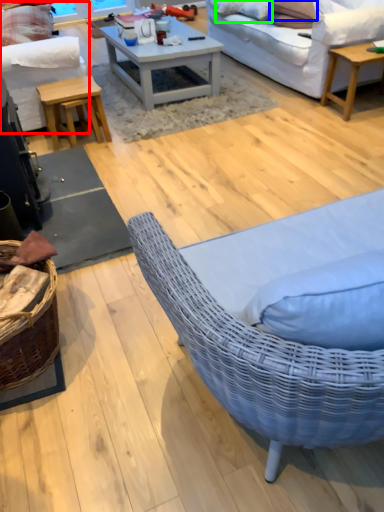
Question: Based on their relative distances, which object is nearer to studio couch (highlighted by a red box)? Choose from pillow (highlighted by a blue box) and pillow (highlighted by a green box).

Choices:
 (A) pillow
 (B) pillow

Answer: (B)